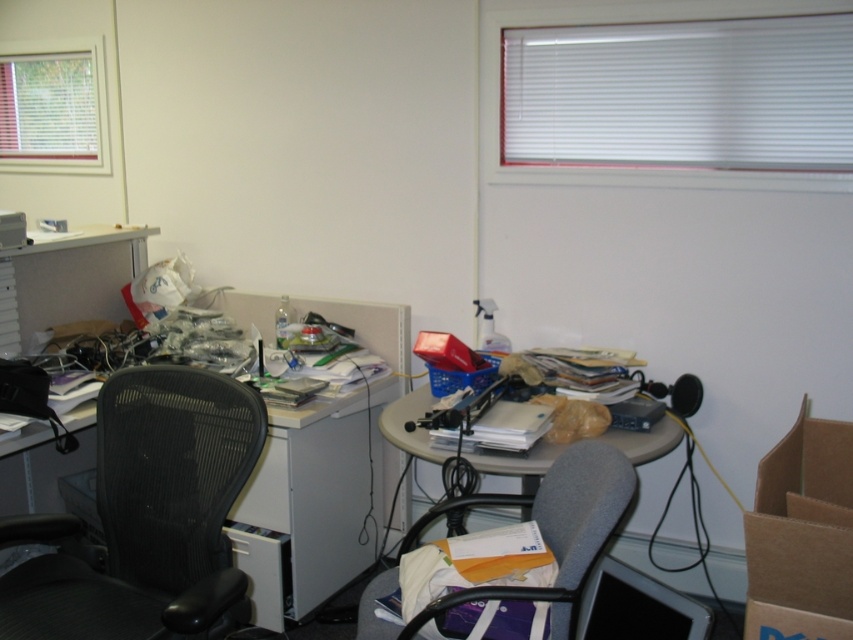
From the picture: You are organizing the office and want to move the brown cardboard box at lower right to the right side of the white plastic computer desk at left. Is there enough space to place it there?

The white plastic computer desk at left is already to the left of the brown cardboard box at lower right, so moving the brown cardboard box at lower right to the right of the white plastic computer desk at left would require more space than available. Therefore, there is not enough space to place it there.

You are organizing the office and need to move the brown cardboard box at lower right to the left side of the matte plastic table at center. Is there enough space to place it there?

The brown cardboard box at lower right is currently to the right of the matte plastic table at center. Moving it to the left side would require space, but since the description only mentions its current position, there is no information provided about available space on the left side of the table. Therefore, it is uncertain if there is enough space to place it there.